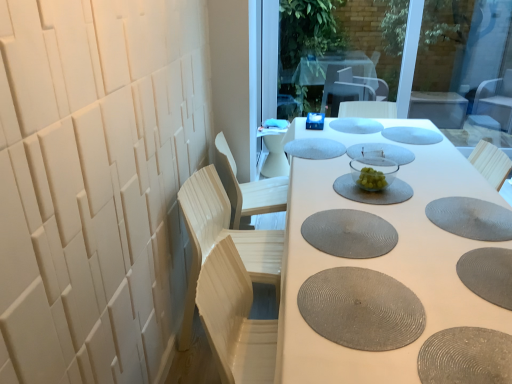
Find the location of `free region under light blue fabric cushion at center, placed as the 8th manhole cover when sorted from front to back (from a real-world perspective)`. free region under light blue fabric cushion at center, placed as the 8th manhole cover when sorted from front to back (from a real-world perspective) is located at coordinates (310, 147).